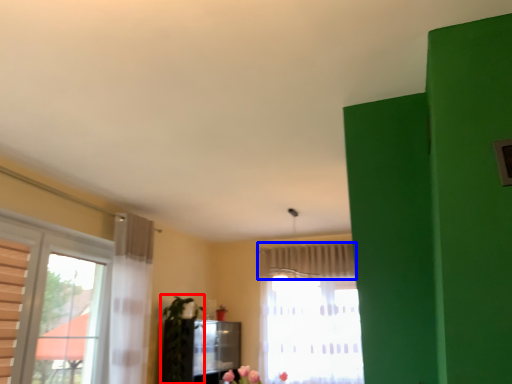
Question: Which object appears closest to the camera in this image, plant (highlighted by a red box) or curtain (highlighted by a blue box)?

Choices:
 (A) plant
 (B) curtain

Answer: (A)